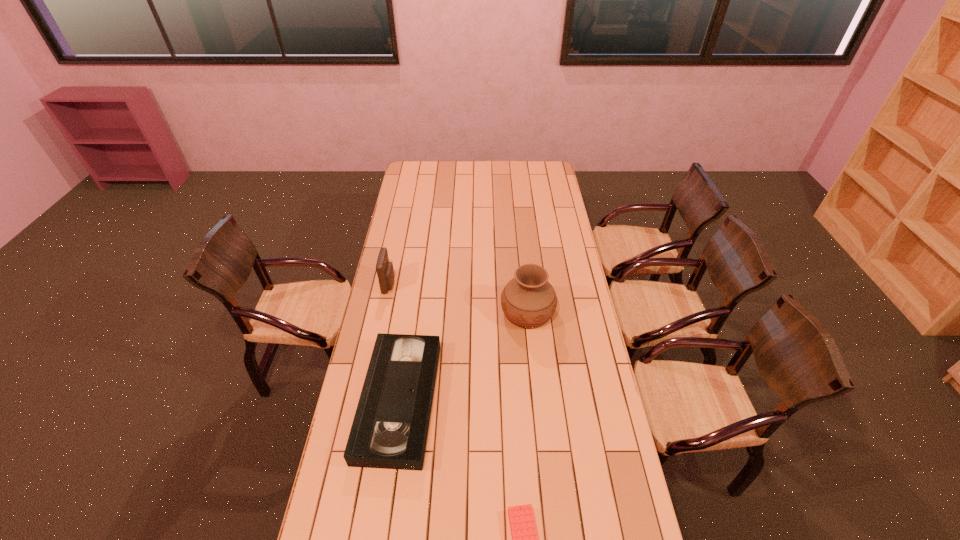
I want to click on free space at the far edge of the desktop, so click(449, 177).

Locate an element on the screen. The height and width of the screenshot is (540, 960). free space at the left edge of the desktop is located at coordinates (423, 182).

I want to click on vacant space at the right edge, so click(592, 502).

Identify the location of blank space at the far left corner of the desktop. (429, 175).

This screenshot has width=960, height=540. I want to click on unoccupied area between the third tallest object and the urn, so click(x=464, y=356).

At what (x,y) coordinates should I click in order to perform the action: click on empty location between the videotape and the urn. Please return your answer as a coordinate pair (x, y). The width and height of the screenshot is (960, 540). Looking at the image, I should click on (464, 356).

Identify the location of empty space between the tallest object and the third shortest object. coord(459,298).

Where is `free space between the second tallest object and the urn`? The width and height of the screenshot is (960, 540). free space between the second tallest object and the urn is located at coordinates (459, 298).

In order to click on object that is the third closest to the videotape in this screenshot , I will do `click(385, 272)`.

Identify which object is the second nearest to the urn. Please provide its 2D coordinates. Your answer should be formatted as a tuple, i.e. [(x, y)], where the tuple contains the x and y coordinates of a point satisfying the conditions above.

[(385, 272)]